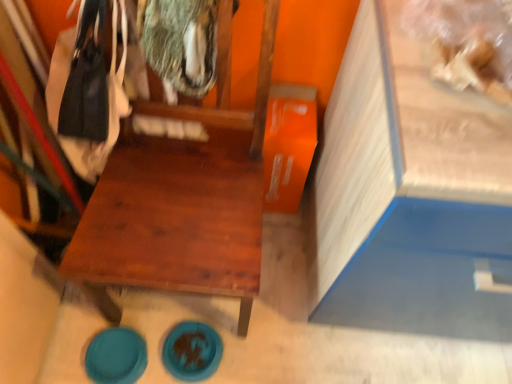
The image size is (512, 384). Identify the location of free space to the left of blue matte plate at lower center, which is counted as the 2th plate, starting from the left. (142, 324).